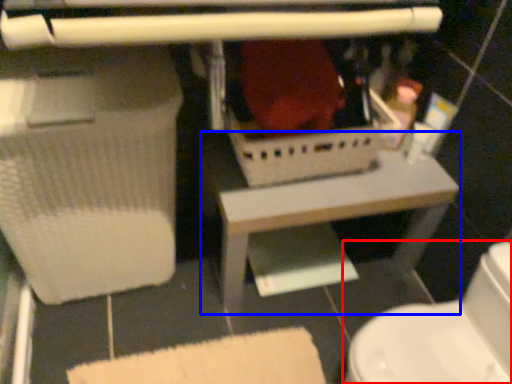
Question: Which of the following is the farthest to the observer, toilet (highlighted by a red box) or table (highlighted by a blue box)?

Choices:
 (A) toilet
 (B) table

Answer: (B)